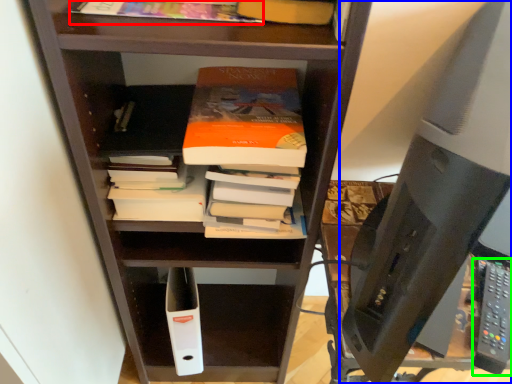
Question: Which object is the farthest from book (highlighted by a red box)? Choose among these: desktop computer (highlighted by a blue box) or remote (highlighted by a green box).

Choices:
 (A) desktop computer
 (B) remote

Answer: (B)